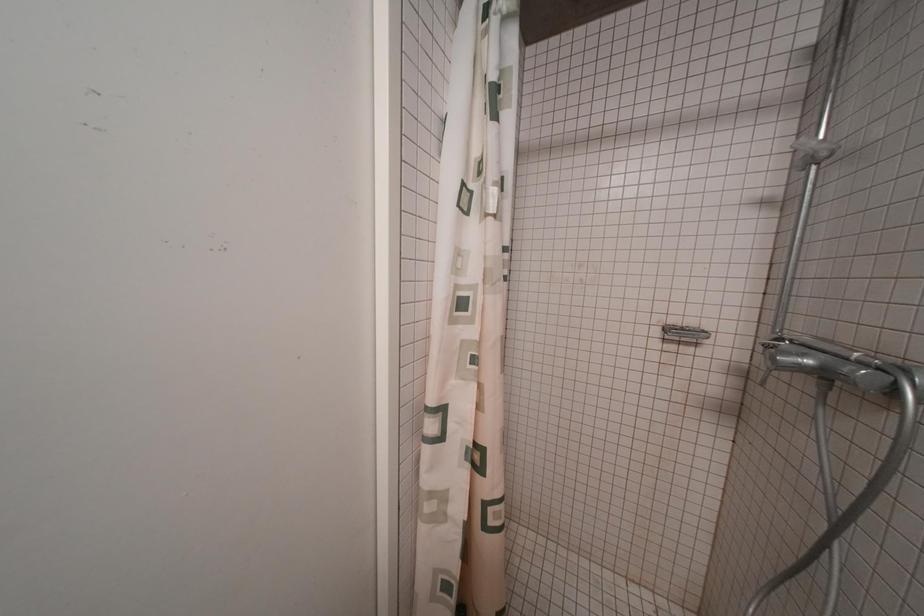
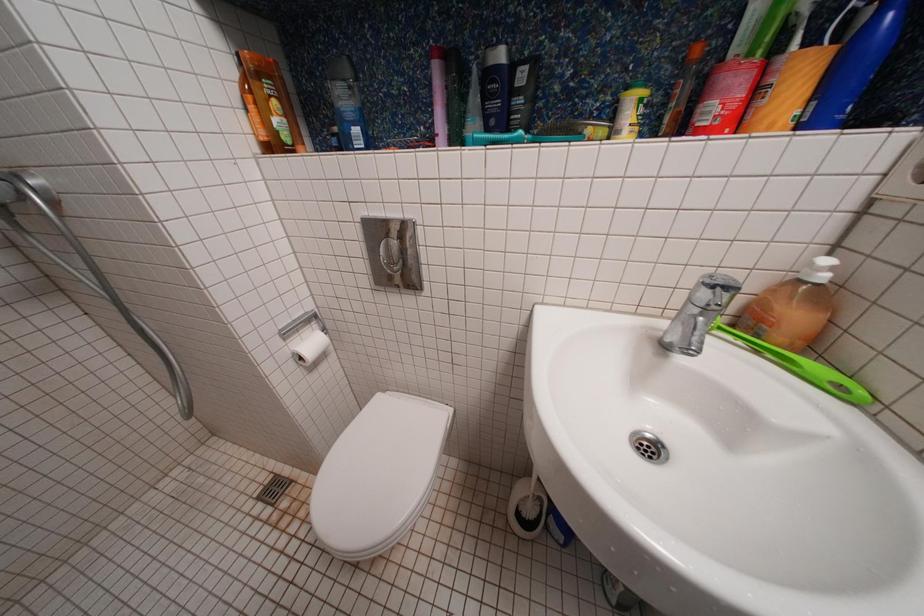
The first image is from the beginning of the video and the second image is from the end. How did the camera likely rotate when shooting the video?

The camera rotated toward right-down.